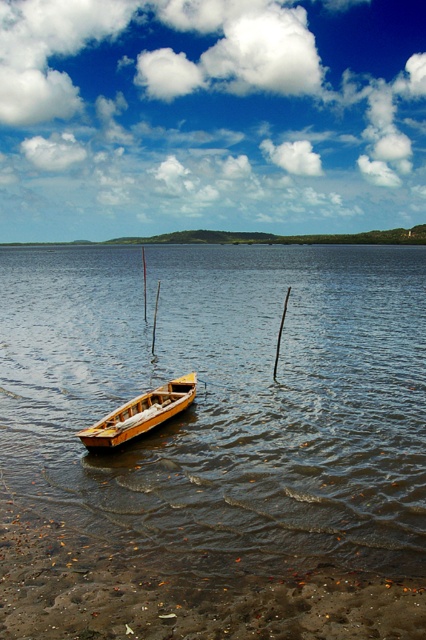
Question: Can you confirm if brown wooden water at center is wider than wooden boat at center?

Choices:
 (A) yes
 (B) no

Answer: (A)

Question: Where is brown wooden water at center located in relation to wooden boat at center in the image?

Choices:
 (A) right
 (B) left

Answer: (B)

Question: Does brown wooden water at center appear under wooden boat at center?

Choices:
 (A) yes
 (B) no

Answer: (B)